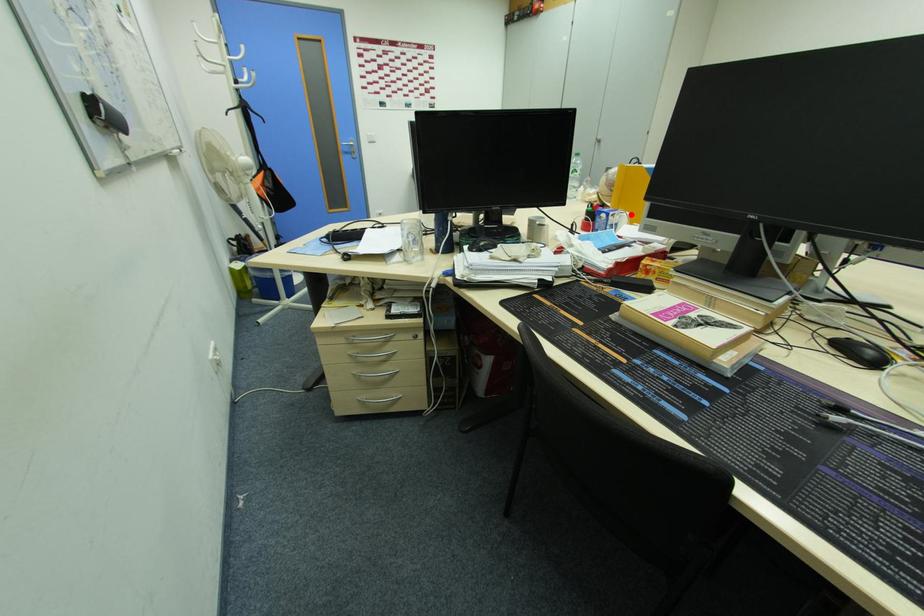
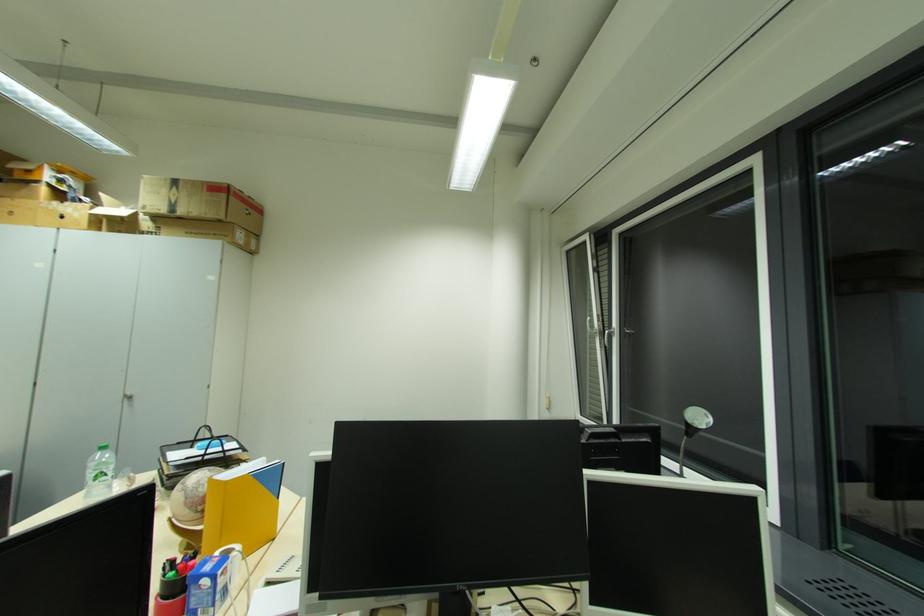
In the second image, find the point that corresponds to the highlighted location in the first image.

(242, 548)